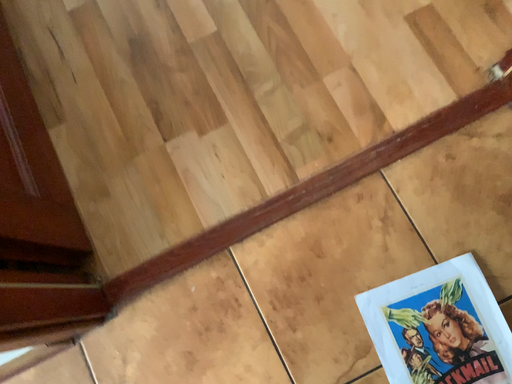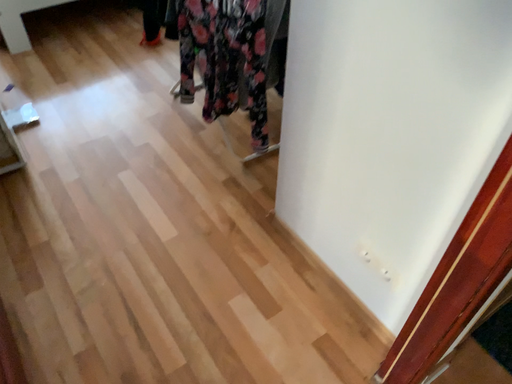
Question: How did the camera likely rotate when shooting the video?

Choices:
 (A) rotated upward
 (B) rotated downward

Answer: (A)